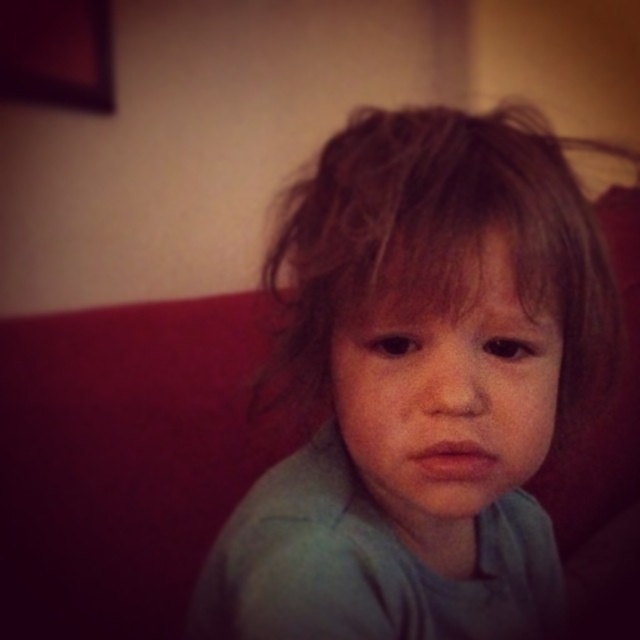
Question: Can you confirm if light blue fabric at center is positioned below smooth skin face at center?

Choices:
 (A) no
 (B) yes

Answer: (A)

Question: Can you confirm if light blue fabric at center is positioned to the left of smooth skin face at center?

Choices:
 (A) yes
 (B) no

Answer: (B)

Question: Which point is closer to the camera?

Choices:
 (A) smooth skin face at center
 (B) light blue fabric at center

Answer: (B)

Question: Which point appears farthest from the camera in this image?

Choices:
 (A) (394, 188)
 (B) (509, 440)

Answer: (B)

Question: Can you confirm if light blue fabric at center is bigger than smooth skin face at center?

Choices:
 (A) no
 (B) yes

Answer: (B)